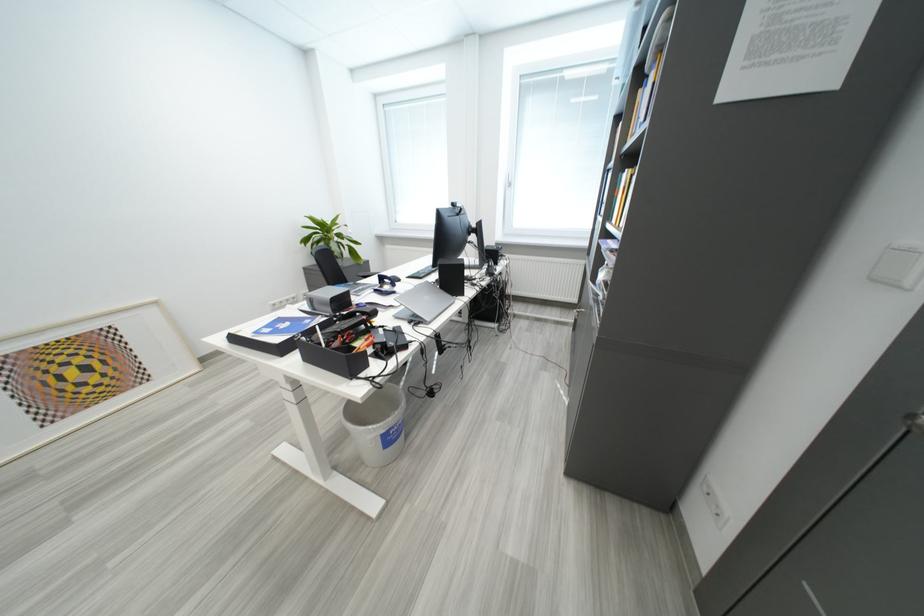
This screenshot has width=924, height=616. What do you see at coordinates (505, 180) in the screenshot?
I see `a silver cabinet lock` at bounding box center [505, 180].